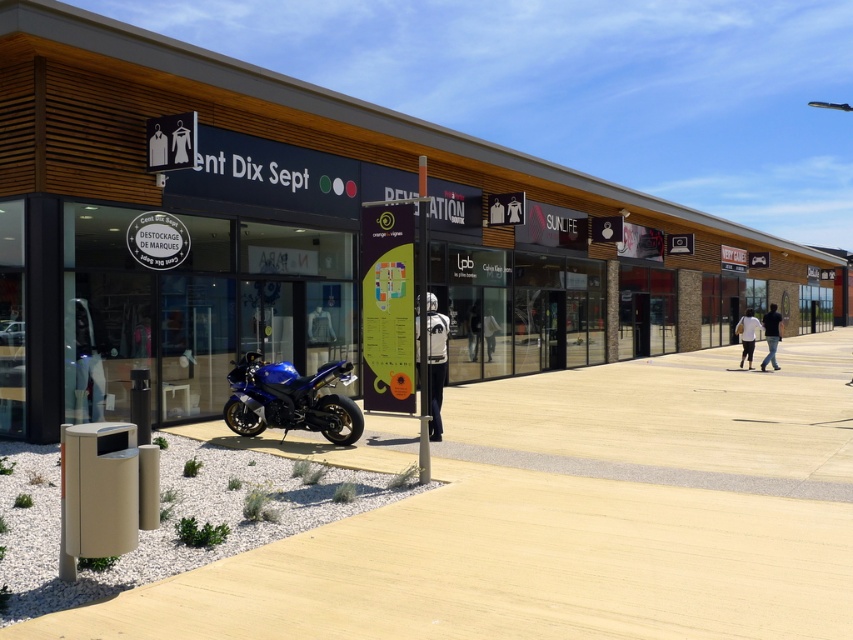
You are standing in front of the store Ent Dix Sept and want to take a photo. You notice two points marked on the storefront at coordinates point [209,216] and point [468,531]. Which point should you focus on first to ensure both are in focus?

You should focus on point [209,216] first because it is closer to the camera than point [468,531]. This ensures that both points will be within the depth of field when taking the photo.

You are a customer standing in the commercial area and want to take a photo of the matte wood mall at center and the blue metallic motorcycle at lower left. Which object should you focus on first if you want to include both in the frame without moving the camera?

The matte wood mall at center is much taller than the blue metallic motorcycle at lower left, so you should focus on the matte wood mall at center first to ensure it fits in the frame.

You are a delivery person needing to park your motorcycle in a spot that is behind the beige concrete pavement at center. Is the blue metallic motorcycle at lower left currently blocking your parking spot?

The beige concrete pavement at center is in front of the blue metallic motorcycle at lower left, meaning the motorcycle is behind the pavement. Therefore, the blue metallic motorcycle at lower left is not blocking your parking spot since it is already positioned behind the beige concrete pavement at center.